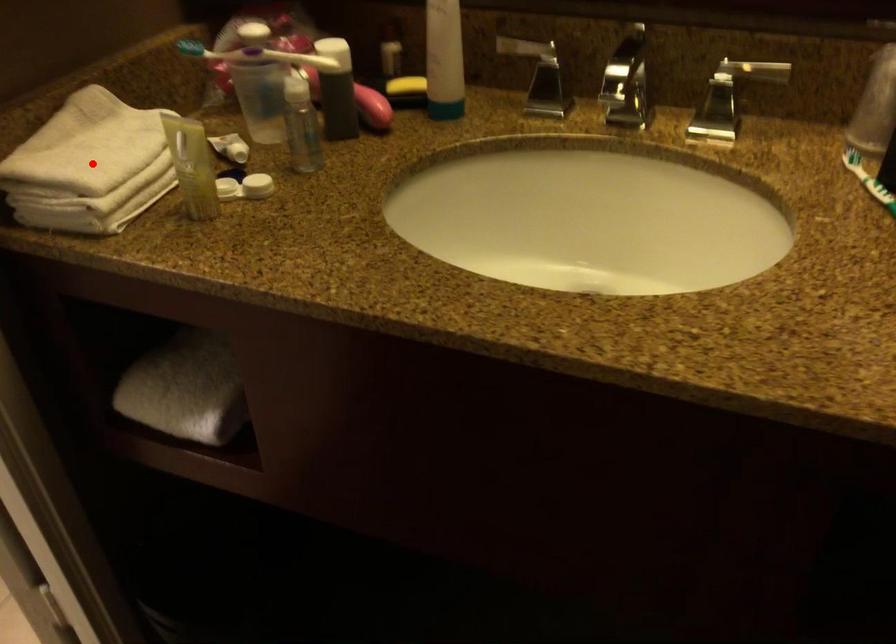
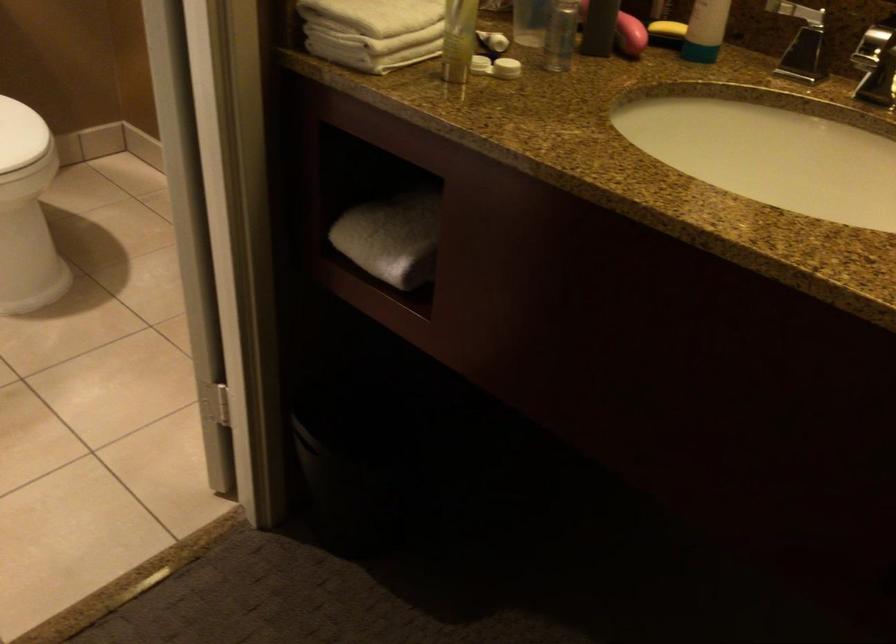
The point at the highlighted location is marked in the first image. Where is the corresponding point in the second image?

(380, 14)